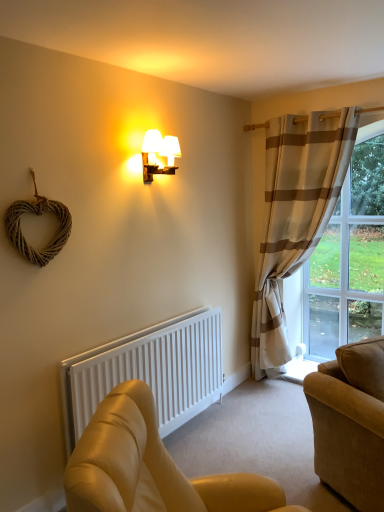
Question: Is leather couch at lower right, positioned as the 2th studio couch in back-to-front order, shorter than clear glass window at right?

Choices:
 (A) yes
 (B) no

Answer: (A)

Question: Are leather couch at lower right, positioned as the 2th studio couch in back-to-front order, and clear glass window at right located far from each other?

Choices:
 (A) yes
 (B) no

Answer: (A)

Question: Would you say leather couch at lower right, acting as the first studio couch starting from the front, is outside clear glass window at right?

Choices:
 (A) no
 (B) yes

Answer: (B)

Question: Is leather couch at lower right, acting as the first studio couch starting from the front, at the right side of clear glass window at right?

Choices:
 (A) no
 (B) yes

Answer: (A)

Question: From a real-world perspective, is leather couch at lower right, positioned as the 2th studio couch in back-to-front order, physically above clear glass window at right?

Choices:
 (A) yes
 (B) no

Answer: (B)

Question: Is leather couch at lower right, acting as the first studio couch starting from the front, taller or shorter than clear glass window at right?

Choices:
 (A) tall
 (B) short

Answer: (B)

Question: Is point (135, 465) closer or farther from the camera than point (369, 251)?

Choices:
 (A) closer
 (B) farther

Answer: (A)

Question: In terms of size, does leather couch at lower right, positioned as the 2th studio couch in back-to-front order, appear bigger or smaller than clear glass window at right?

Choices:
 (A) big
 (B) small

Answer: (A)

Question: In the image, is leather couch at lower right, acting as the first studio couch starting from the front, positioned in front of or behind clear glass window at right?

Choices:
 (A) front
 (B) behind

Answer: (A)

Question: Considering the positions of point tap(281, 164) and point tap(94, 479), is point tap(281, 164) closer or farther from the camera than point tap(94, 479)?

Choices:
 (A) closer
 (B) farther

Answer: (B)

Question: Visually, is beige striped curtain at right positioned to the left or to the right of leather couch at lower right, positioned as the 2th studio couch in back-to-front order?

Choices:
 (A) right
 (B) left

Answer: (A)

Question: Relative to leather couch at lower right, positioned as the 2th studio couch in back-to-front order, is beige striped curtain at right in front or behind?

Choices:
 (A) front
 (B) behind

Answer: (B)

Question: From a real-world perspective, is beige striped curtain at right above or below leather couch at lower right, positioned as the 2th studio couch in back-to-front order?

Choices:
 (A) below
 (B) above

Answer: (B)

Question: Based on their sizes in the image, would you say white matte radiator at lower left is bigger or smaller than leather couch at lower right, positioned as the 2th studio couch in back-to-front order?

Choices:
 (A) big
 (B) small

Answer: (B)

Question: In the image, is white matte radiator at lower left positioned in front of or behind leather couch at lower right, positioned as the 2th studio couch in back-to-front order?

Choices:
 (A) behind
 (B) front

Answer: (A)